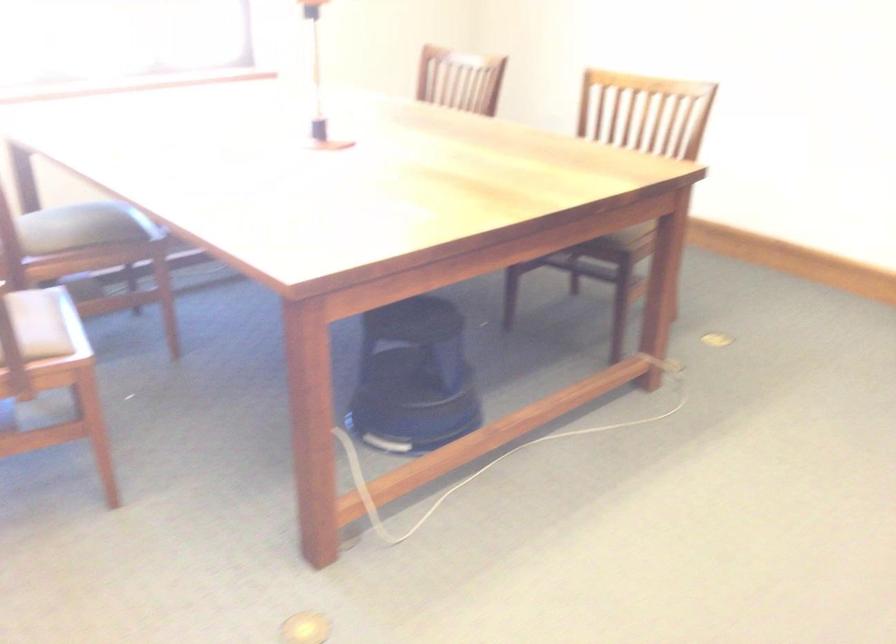
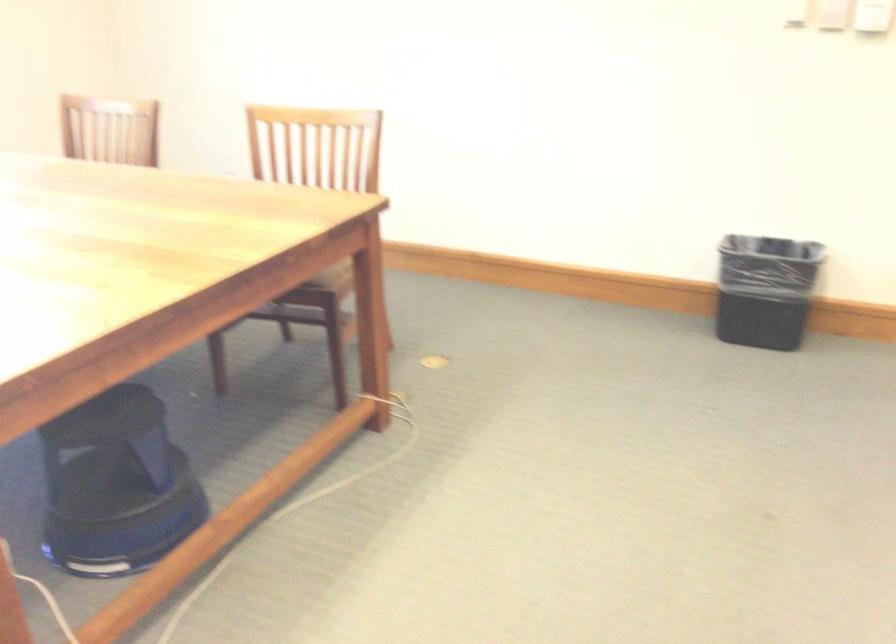
Question: What movement of the cameraman would produce the second image?

Choices:
 (A) Left
 (B) Right
 (C) Forward
 (D) Backward

Answer: (C)